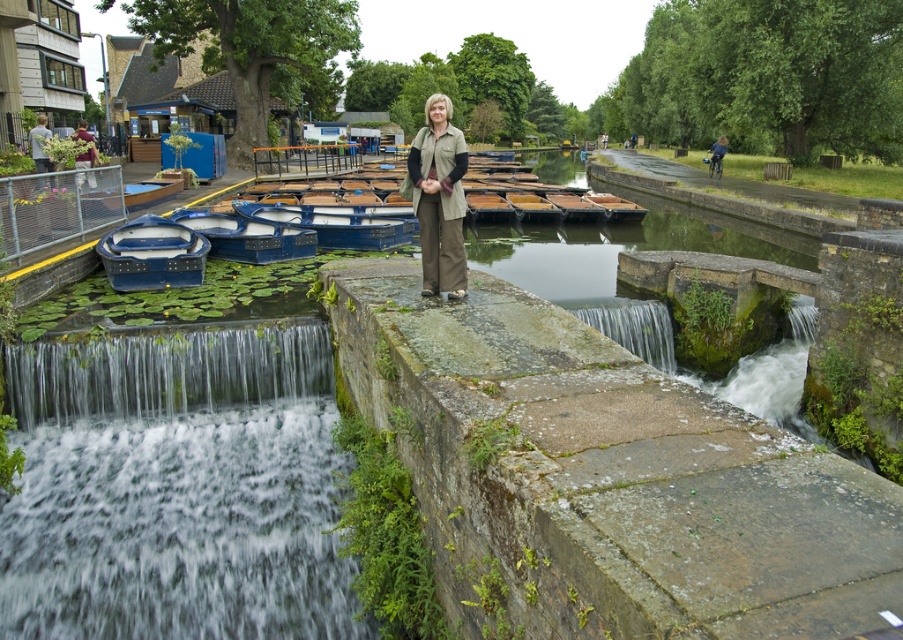
Between khaki fabric jacket at center and wooden boat at center, which one has less height?

Standing shorter between the two is wooden boat at center.

Can you confirm if khaki fabric jacket at center is smaller than wooden boat at center?

No.

Does point (422, 195) lie behind point (612, 211)?

No.

This screenshot has height=640, width=903. Find the location of `khaki fabric jacket at center`. khaki fabric jacket at center is located at coordinates 439,198.

Which is more to the right, gray stone waterfall at center or wooden boat at center?

wooden boat at center

Which is above, gray stone waterfall at center or wooden boat at center?

Positioned higher is wooden boat at center.

This screenshot has width=903, height=640. Describe the element at coordinates (630, 324) in the screenshot. I see `gray stone waterfall at center` at that location.

The width and height of the screenshot is (903, 640). I want to click on gray stone waterfall at center, so click(x=630, y=324).

In the scene shown: Is khaki fabric jacket at center taller than blue plastic boats at center?

Yes.

Does khaki fabric jacket at center have a smaller size compared to blue plastic boats at center?

No, khaki fabric jacket at center is not smaller than blue plastic boats at center.

Which is behind, point (434, 116) or point (248, 230)?

Positioned behind is point (248, 230).

Where is `khaki fabric jacket at center`? This screenshot has width=903, height=640. khaki fabric jacket at center is located at coordinates (439, 198).